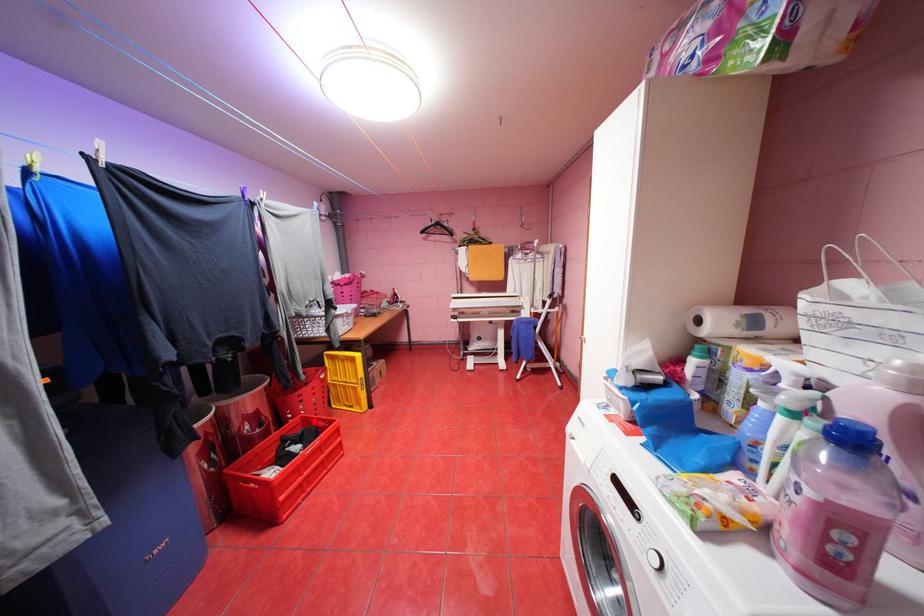
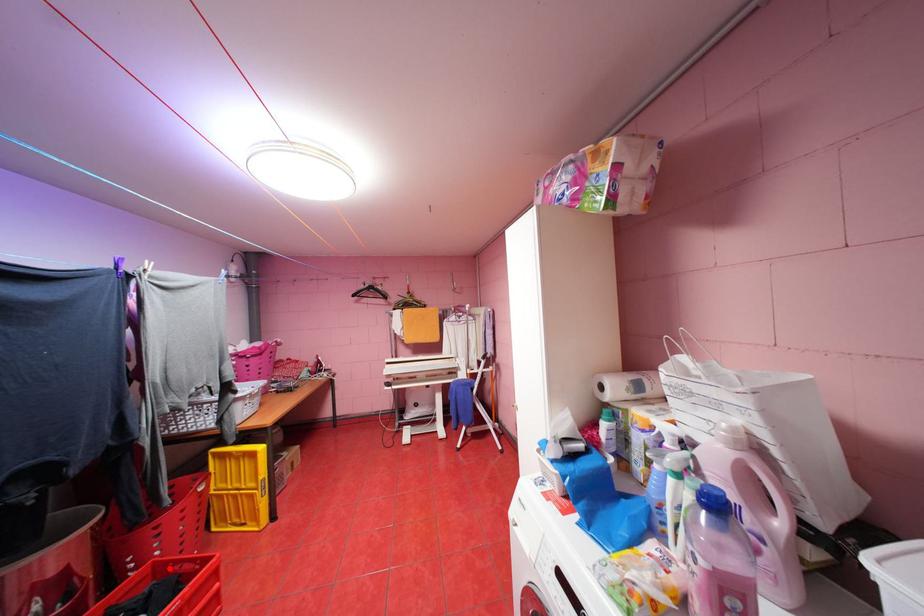
I am providing you with two images of the same scene from different viewpoints. A red point is marked on the first image and another point is marked on the second image. Do the highlighted points in image1 and image2 indicate the same real-world spot?

Yes